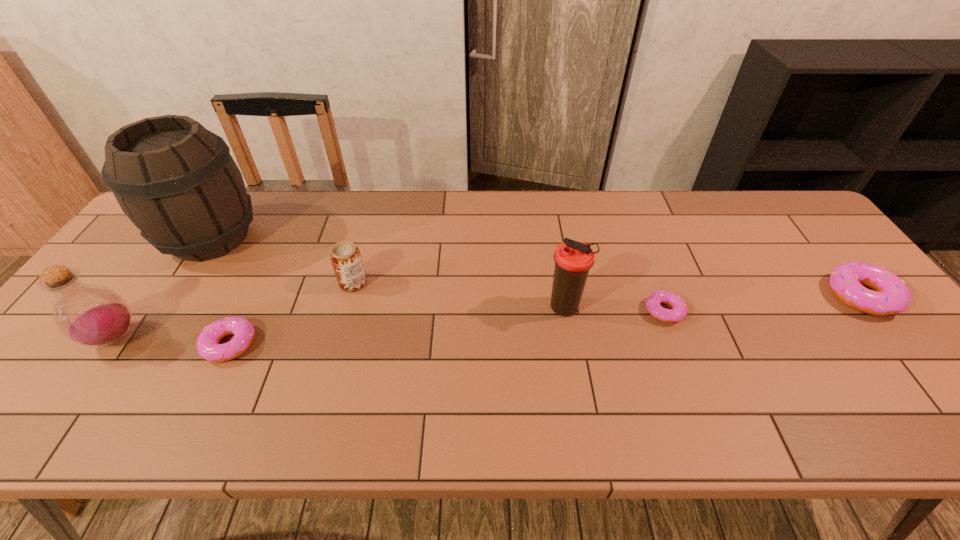
Identify the location of the third closest object to the bottle. The height and width of the screenshot is (540, 960). (346, 260).

You are a GUI agent. You are given a task and a screenshot of the screen. Output one action in this format:
    pyautogui.click(x=<x>, y=<y>)
    Task: Click on the doughnut that is the closest to the bottle
    
    Given the screenshot: What is the action you would take?
    pyautogui.click(x=207, y=345)

Select which doughnut appears as the second closest to the rightmost object. Please provide its 2D coordinates. Your answer should be formatted as a tuple, i.e. [(x, y)], where the tuple contains the x and y coordinates of a point satisfying the conditions above.

[(207, 345)]

The image size is (960, 540). I want to click on blank area in the image that satisfies the following two spatial constraints: 1. on the front side of the third object from right to left; 2. on the left side of the tallest object, so click(166, 308).

Identify the location of free location that satisfies the following two spatial constraints: 1. on the back side of the fourth object from left to right; 2. on the right side of the bottle. This screenshot has width=960, height=540. (154, 282).

Locate an element on the screen. This screenshot has height=540, width=960. free spot that satisfies the following two spatial constraints: 1. on the back side of the leftmost doughnut; 2. on the right side of the third object from right to left is located at coordinates (247, 308).

Identify the location of blank area in the image that satisfies the following two spatial constraints: 1. on the back side of the leftmost doughnut; 2. on the left side of the rightmost object. Image resolution: width=960 pixels, height=540 pixels. (253, 296).